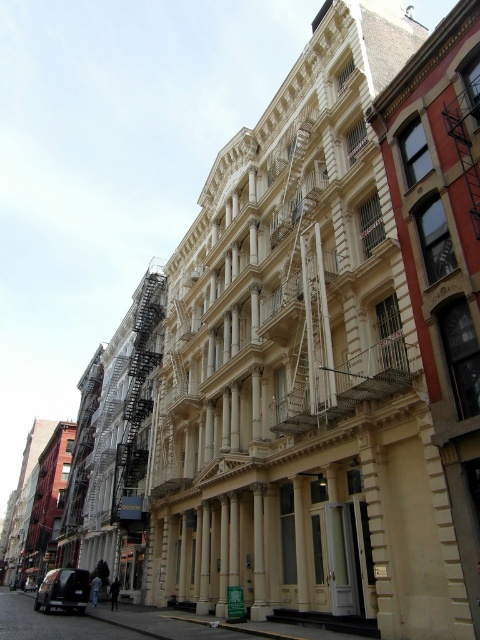
You are a delivery person trying to park your shiny black car at lower left near the black metal fire escape at left. Can you park your car there without hitting the fire escape?

The black metal fire escape at left is thinner than the shiny black car at lower left, so there might not be enough space to park the car there without hitting the fire escape.

You are a delivery driver who needs to park your car 100 feet away from the black metal fire escape at left. You currently have a shiny black car at lower left. Can you park your car in its current position?

The black metal fire escape at left is 99.91 feet from the shiny black car at lower left. Since the required distance is 100 feet and the current distance is slightly less, you cannot park the shiny black car at lower left in its current position as it is too close to the fire escape.

Looking at this image, you are a delivery driver who needs to park your shiny black car at lower left as close as possible to the building entrance without blocking the black metal fire escape at left. Can you park your car there?

The black metal fire escape at left is located above the shiny black car at lower left, which means the car is parked directly underneath it. Since the fire escape is above, parking there would not block the fire escape pathway. Therefore, you can park your shiny black car at lower left close to the building entrance without obstructing the black metal fire escape at left.